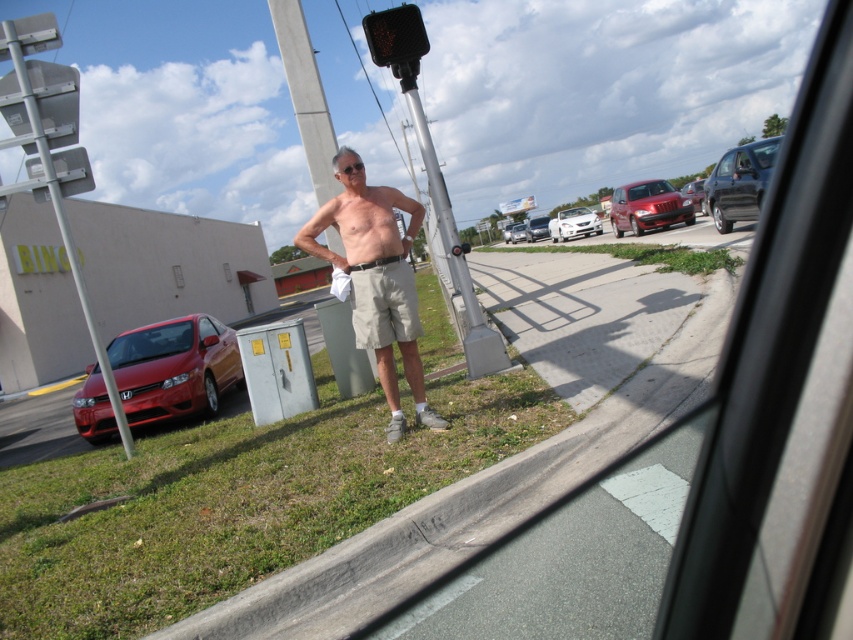
Question: Which object appears farthest from the camera in this image?

Choices:
 (A) skinny white muscle at center
 (B) silver metallic sedan at center

Answer: (B)

Question: Which of these objects is positioned closest to the silver metallic sedan at center?

Choices:
 (A) khaki shorts at center
 (B) shiny red sedan at center

Answer: (B)

Question: Which of the following is the closest to the observer?

Choices:
 (A) tan khaki shorts at center
 (B) khaki shorts at center

Answer: (B)

Question: Is silver metallic pole at center bigger than white glossy car at center?

Choices:
 (A) no
 (B) yes

Answer: (A)

Question: Does skinny white muscle at center appear on the right side of shiny black sedan at right?

Choices:
 (A) yes
 (B) no

Answer: (B)

Question: Is tan khaki shorts at center smaller than white glossy car at center?

Choices:
 (A) no
 (B) yes

Answer: (B)